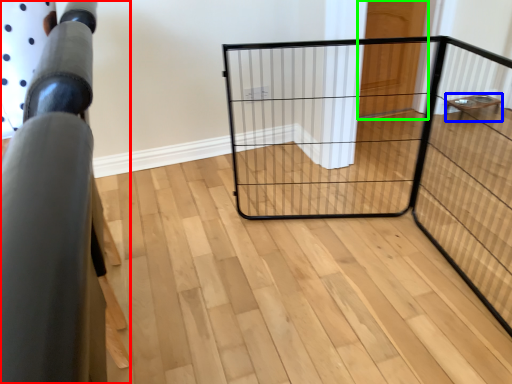
Question: Which object is the farthest from furniture (highlighted by a red box)? Choose among these: furniture (highlighted by a blue box) or door (highlighted by a green box).

Choices:
 (A) furniture
 (B) door

Answer: (A)